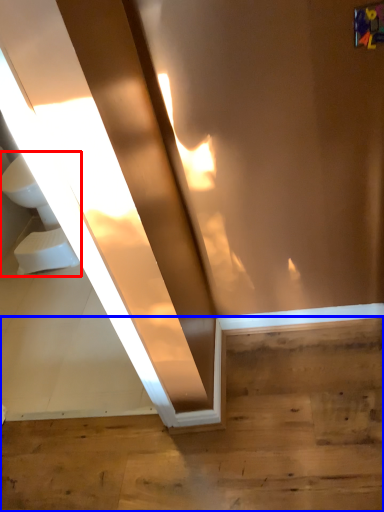
Question: Among these objects, which one is nearest to the camera, sink (highlighted by a red box) or stairwell (highlighted by a blue box)?

Choices:
 (A) sink
 (B) stairwell

Answer: (B)